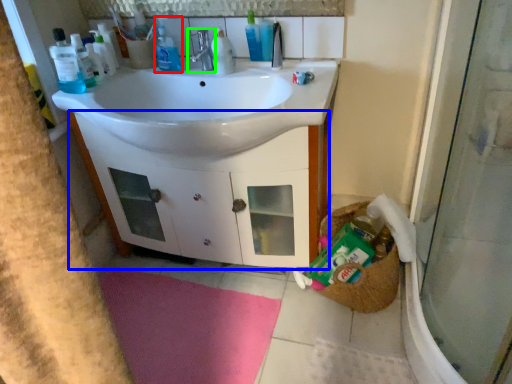
Question: Which object is the farthest from cleaning product (highlighted by a red box)? Choose among these: bathroom cabinet (highlighted by a blue box) or tap (highlighted by a green box).

Choices:
 (A) bathroom cabinet
 (B) tap

Answer: (A)